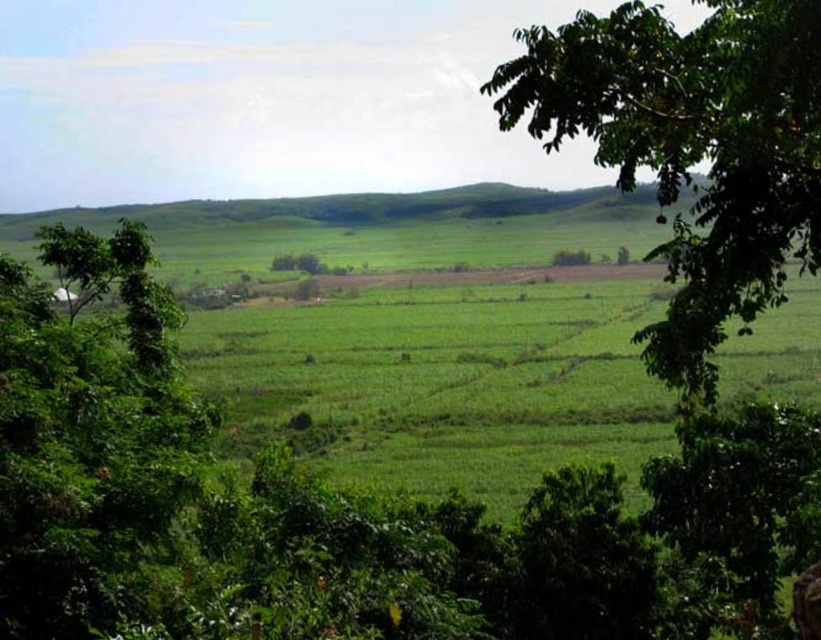
You are standing in the middle of the green grassy field at center and want to walk to the green leafy tree at left. Which direction should you head to reach the tree?

The green leafy tree at left is positioned to the left side of the green grassy field at center. Since the green grassy field at center is wider than the green leafy tree at left, you should head towards the left direction to reach the tree.

You are standing in the middle of the rural landscape and want to take a photo. There are two points in the scene labeled as point 1 at coordinates [760,236] and point 2 at coordinates [33,317]. Which point will appear closer to you in the photo?

Point 1 at coordinates [760,236] will appear closer to you in the photo because it is closer to the camera than point 2 at coordinates [33,317].